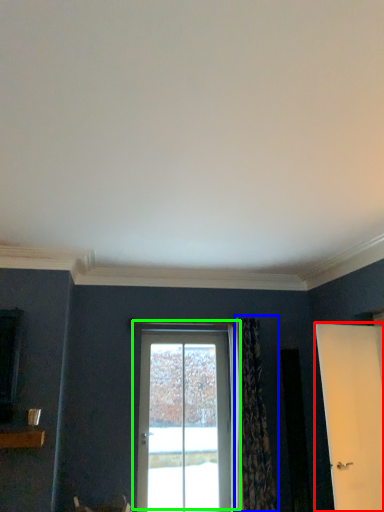
Question: Estimate the real-world distances between objects in this image. Which object is farther from door (highlighted by a red box), curtain (highlighted by a blue box) or door (highlighted by a green box)?

Choices:
 (A) curtain
 (B) door

Answer: (B)